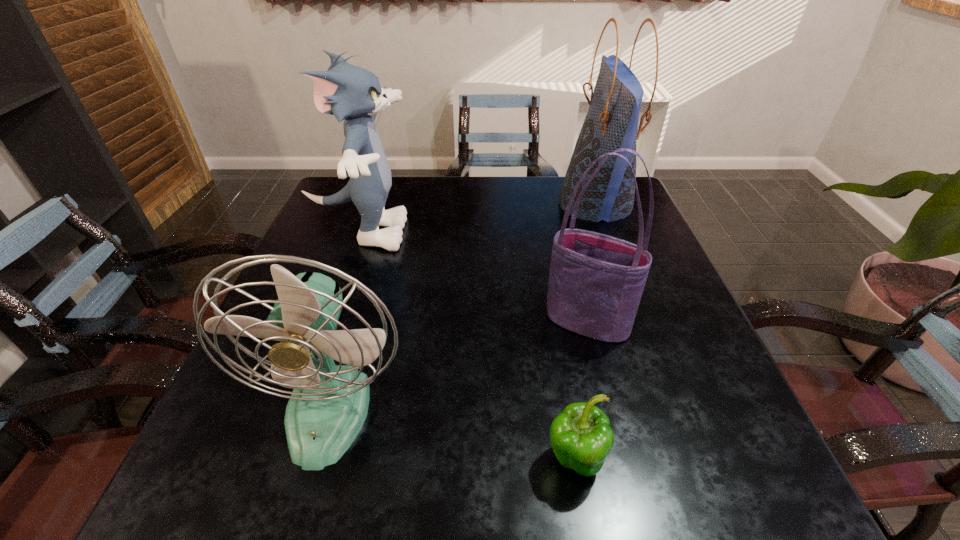
Where is `free space between the fan and the tote bag`? This screenshot has height=540, width=960. free space between the fan and the tote bag is located at coordinates tap(458, 365).

Locate an element on the screen. The height and width of the screenshot is (540, 960). blank region between the bell pepper and the fan is located at coordinates (452, 434).

The height and width of the screenshot is (540, 960). Find the location of `unoccupied position between the third nearest object and the cat`. unoccupied position between the third nearest object and the cat is located at coordinates (473, 278).

Where is `vacant region between the fan and the tote bag`? vacant region between the fan and the tote bag is located at coordinates click(x=458, y=365).

The width and height of the screenshot is (960, 540). I want to click on free space between the tote bag and the fan, so click(x=458, y=365).

Identify the location of free point between the fan and the third farthest object. (458, 365).

This screenshot has width=960, height=540. I want to click on object that stands as the fourth closest to the cat, so click(x=581, y=437).

Image resolution: width=960 pixels, height=540 pixels. I want to click on object that can be found as the second closest to the cat, so click(596, 281).

Locate an element on the screen. The image size is (960, 540). free location that satisfies the following two spatial constraints: 1. on the front-facing side of the tote bag; 2. on the left side of the cat is located at coordinates (328, 322).

The width and height of the screenshot is (960, 540). I want to click on free location that satisfies the following two spatial constraints: 1. on the back side of the tote bag; 2. on the front-facing side of the cat, so click(564, 233).